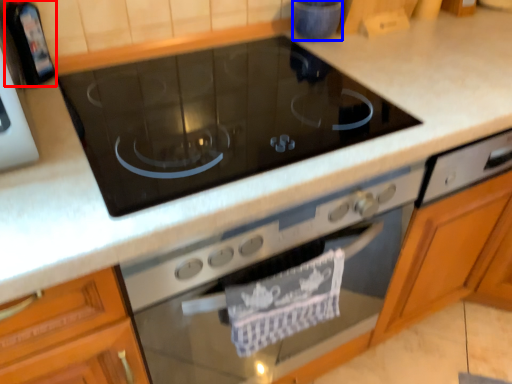
Question: Which point is closer to the camera, appliance (highlighted by a red box) or appliance (highlighted by a blue box)?

Choices:
 (A) appliance
 (B) appliance

Answer: (A)